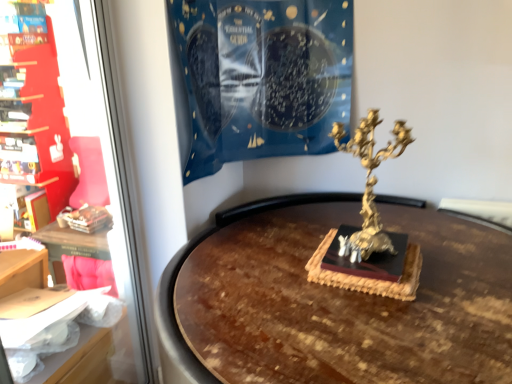
Describe the element at coordinates (262, 77) in the screenshot. I see `blue fabric at upper center` at that location.

Where is `matte red bookshelf at left`? matte red bookshelf at left is located at coordinates (33, 113).

You are a GUI agent. You are given a task and a screenshot of the screen. Output one action in this format:
    pyautogui.click(x=<x>, y=<y>)
    Task: Click on the matte red bookshelf at left
    
    Given the screenshot: What is the action you would take?
    pyautogui.click(x=69, y=176)

What do you see at coordinates (368, 258) in the screenshot?
I see `black matte book at center` at bounding box center [368, 258].

The height and width of the screenshot is (384, 512). I want to click on blue fabric at upper center, so [262, 77].

Which object is wider, matte red bookshelf at left or gold metallic candelabra at center-right?

Wider between the two is gold metallic candelabra at center-right.

Consider the image. In the image, is matte red bookshelf at left on the left side or the right side of gold metallic candelabra at center-right?

From the image, it's evident that matte red bookshelf at left is to the left of gold metallic candelabra at center-right.

Locate an element on the screen. The image size is (512, 384). sculpture that appears above the matte red bookshelf at left (from a real-world perspective) is located at coordinates (368, 221).

Considering the relative sizes of matte red bookshelf at left and black matte book at center in the image provided, is matte red bookshelf at left smaller than black matte book at center?

Actually, matte red bookshelf at left might be larger than black matte book at center.

From the image's perspective, would you say matte red bookshelf at left is positioned over black matte book at center?

Indeed, from the image's perspective, matte red bookshelf at left is shown above black matte book at center.

Is matte red bookshelf at left positioned in front of black matte book at center?

No, it is not.

Is matte red bookshelf at left not inside black matte book at center?

Absolutely, matte red bookshelf at left is external to black matte book at center.

From the image's perspective, which one is positioned lower, matte red bookshelf at left or black matte book at center?

From the image's view, matte red bookshelf at left is below.

Considering the relative positions of matte red bookshelf at left and black matte book at center in the image provided, is matte red bookshelf at left in front of black matte book at center?

Yes, matte red bookshelf at left is closer to the camera.

At what (x,y) coordinates should I click in order to perform the action: click on shop window that appears above the black matte book at center (from a real-world perspective). Please return your answer as a coordinate pair (x, y). The height and width of the screenshot is (384, 512). Looking at the image, I should click on click(69, 176).

Does matte red bookshelf at left have a lesser height compared to black matte book at center?

In fact, matte red bookshelf at left may be taller than black matte book at center.

From their relative heights in the image, would you say matte red bookshelf at left is taller or shorter than matte red bookshelf at left?

Clearly, matte red bookshelf at left is taller compared to matte red bookshelf at left.

Based on their sizes in the image, would you say matte red bookshelf at left is bigger or smaller than matte red bookshelf at left?

Clearly, matte red bookshelf at left is smaller in size than matte red bookshelf at left.

Is matte red bookshelf at left surrounding matte red bookshelf at left?

No.

From the image's perspective, between blue fabric at upper center and matte red bookshelf at left, who is located below?

From the image's view, matte red bookshelf at left is below.

Based on their sizes in the image, would you say blue fabric at upper center is bigger or smaller than matte red bookshelf at left?

blue fabric at upper center is bigger than matte red bookshelf at left.

Who is more distant, blue fabric at upper center or matte red bookshelf at left?

blue fabric at upper center is behind.

Is blue fabric at upper center located outside matte red bookshelf at left?

Yes, blue fabric at upper center is located beyond the bounds of matte red bookshelf at left.

Is point (64, 172) closer or farther from the camera than point (192, 42)?

Point (64, 172) is positioned farther from the camera compared to point (192, 42).

From a real-world perspective, is matte red bookshelf at left physically located above or below blue fabric at upper center?

From a real-world perspective, matte red bookshelf at left is physically below blue fabric at upper center.

Considering the relative sizes of matte red bookshelf at left and blue fabric at upper center in the image provided, is matte red bookshelf at left wider than blue fabric at upper center?

Incorrect, the width of matte red bookshelf at left does not surpass that of blue fabric at upper center.

Is matte red bookshelf at left closer to camera compared to blue fabric at upper center?

No, the depth of matte red bookshelf at left is greater than that of blue fabric at upper center.

Is black matte book at center oriented towards gold metallic candelabra at center-right?

No, black matte book at center does not turn towards gold metallic candelabra at center-right.

Is point (336, 265) positioned before point (333, 127)?

That is True.

How different are the orientations of black matte book at center and gold metallic candelabra at center-right in degrees?

The angular difference between black matte book at center and gold metallic candelabra at center-right is 0.879 degrees.

Is black matte book at center situated inside gold metallic candelabra at center-right or outside?

black matte book at center is located beyond the bounds of gold metallic candelabra at center-right.

At what (x,y) coordinates should I click in order to perform the action: click on shop window on the left side of gold metallic candelabra at center-right. Please return your answer as a coordinate pair (x, y). Looking at the image, I should click on (x=69, y=176).

Image resolution: width=512 pixels, height=384 pixels. I want to click on furniture above the black matte book at center (from the image's perspective), so click(33, 113).

Based on their spatial positions, is matte red bookshelf at left or matte red bookshelf at left closer to black matte book at center?

matte red bookshelf at left is positioned closer to the anchor black matte book at center.

Which object lies further to the anchor point blue fabric at upper center, matte red bookshelf at left or matte red bookshelf at left?

Result: matte red bookshelf at left lies further to blue fabric at upper center than the other object.

When comparing their distances from matte red bookshelf at left, does black matte book at center or matte red bookshelf at left seem closer?

matte red bookshelf at left is positioned closer to the anchor matte red bookshelf at left.

Which object lies further to the anchor point matte red bookshelf at left, matte red bookshelf at left or gold metallic candelabra at center-right?

gold metallic candelabra at center-right is positioned further to the anchor matte red bookshelf at left.

Which object lies nearer to the anchor point matte red bookshelf at left, black matte book at center or gold metallic candelabra at center-right?

Based on the image, gold metallic candelabra at center-right appears to be nearer to matte red bookshelf at left.

Looking at the image, which one is located further to matte red bookshelf at left, blue fabric at upper center or black matte book at center?

black matte book at center.

Considering their positions, is blue fabric at upper center positioned closer to matte red bookshelf at left than matte red bookshelf at left?

matte red bookshelf at left lies closer to matte red bookshelf at left than the other object.

From the image, which object appears to be nearer to matte red bookshelf at left, blue fabric at upper center or gold metallic candelabra at center-right?

Based on the image, blue fabric at upper center appears to be nearer to matte red bookshelf at left.

Where is `curtain between matte red bookshelf at left and gold metallic candelabra at center-right`? The width and height of the screenshot is (512, 384). curtain between matte red bookshelf at left and gold metallic candelabra at center-right is located at coordinates (262, 77).

What are the coordinates of `curtain between matte red bookshelf at left and gold metallic candelabra at center-right from left to right` in the screenshot? It's located at (262, 77).

The height and width of the screenshot is (384, 512). I want to click on curtain located between matte red bookshelf at left and black matte book at center in the left-right direction, so click(262, 77).

Where is `curtain located between matte red bookshelf at left and black matte book at center in the left-right direction`? This screenshot has height=384, width=512. curtain located between matte red bookshelf at left and black matte book at center in the left-right direction is located at coordinates (262, 77).